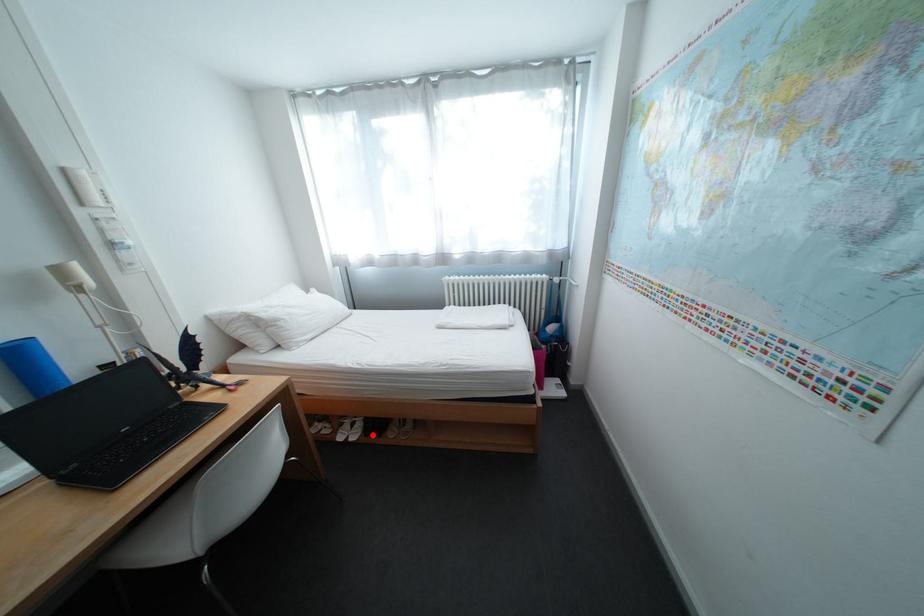
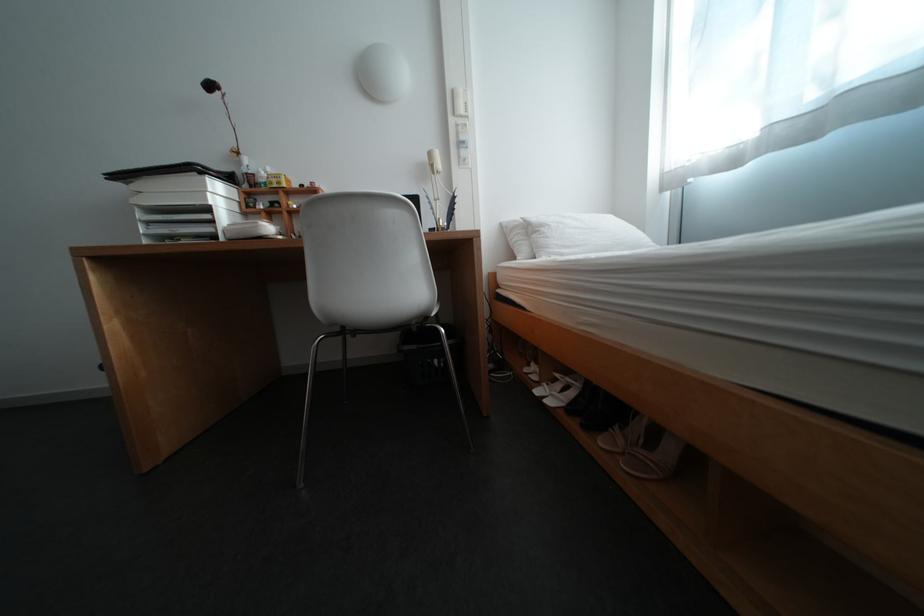
In the second image, find the point that corresponds to the highlighted location in the first image.

(576, 406)